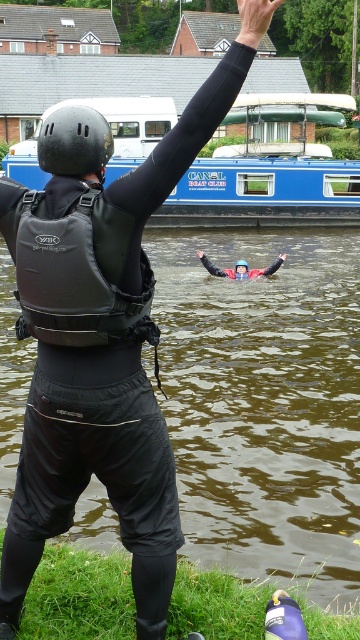
Question: Which object is positioned closest to the matte black helmet at upper center?

Choices:
 (A) blue matte boat at center
 (B) red rubber life jacket at center

Answer: (B)

Question: Which object is positioned closest to the matte black helmet at upper center?

Choices:
 (A) red rubber life jacket at center
 (B) black matte arm at upper center
 (C) blue matte boat at center

Answer: (A)

Question: From the image, what is the correct spatial relationship of red rubber life jacket at center in relation to matte black helmet at upper center?

Choices:
 (A) above
 (B) below

Answer: (A)

Question: Estimate the real-world distances between objects in this image. Which object is farther from the black matte helmet at upper center?

Choices:
 (A) blue matte boat at center
 (B) black matte arm at upper center

Answer: (A)

Question: Can you confirm if black matte helmet at upper center is thinner than matte black helmet at upper center?

Choices:
 (A) yes
 (B) no

Answer: (B)

Question: In this image, where is red rubber life jacket at center located relative to matte black helmet at upper center?

Choices:
 (A) left
 (B) right

Answer: (A)